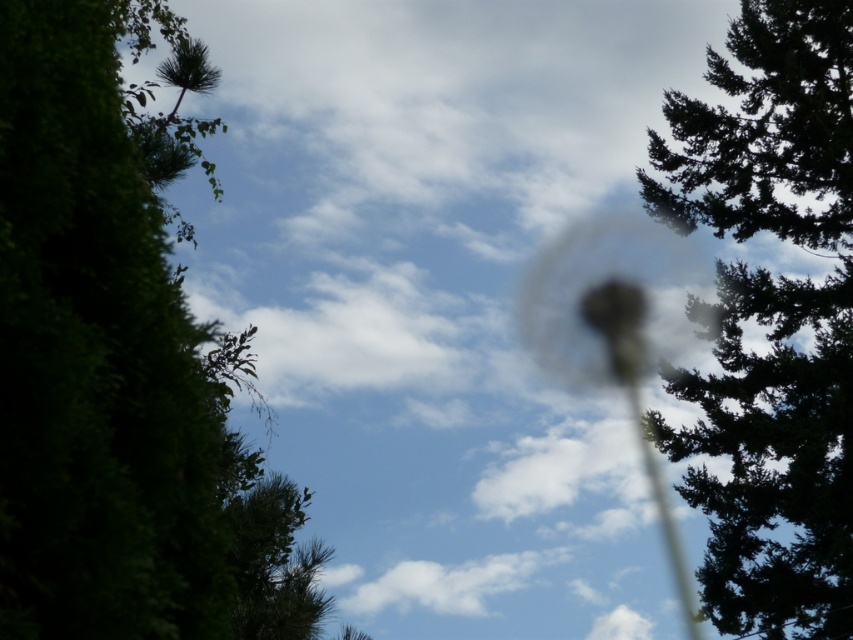
You are a bird flying in the sky and want to land on a tree with more space to perch. Based on the scene, which tree would you choose between the green leafy tree at left and the green textured tree at upper right?

The green textured tree at upper right has a larger width than the green leafy tree at left, so it offers more space to perch.

You are a bird flying in the sky and want to land on the tallest tree. Which tree should you choose between the green leafy tree at left and the green textured tree at upper right?

The green textured tree at upper right is taller than the green leafy tree at left, so you should choose the green textured tree at upper right to land on.

You are an artist trying to paint the scene. You want to ensure the green leafy tree at left and green textured tree at upper right are proportionally accurate. Which tree should you make smaller in your painting?

The green leafy tree at left should be made smaller because it occupies less space than the green textured tree at upper right according to the description.